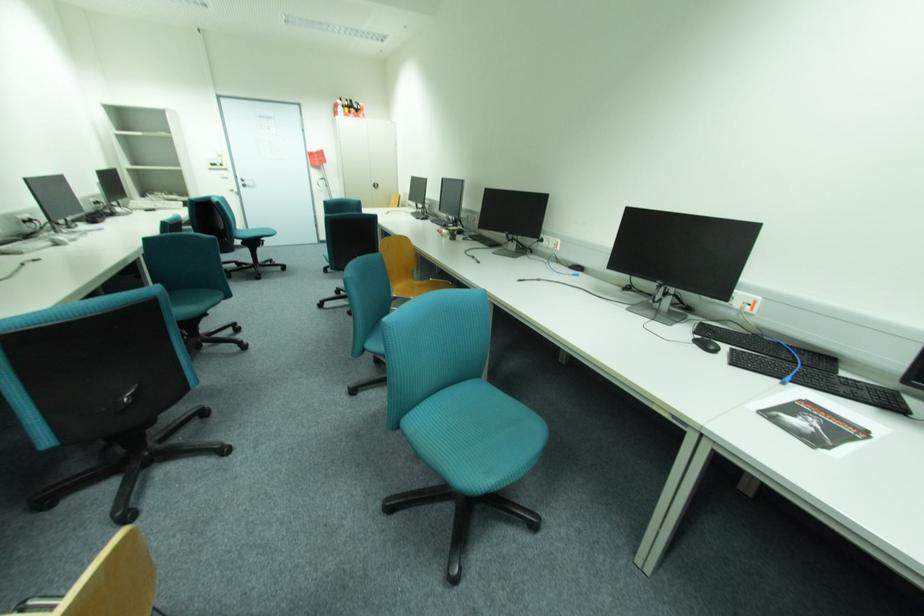
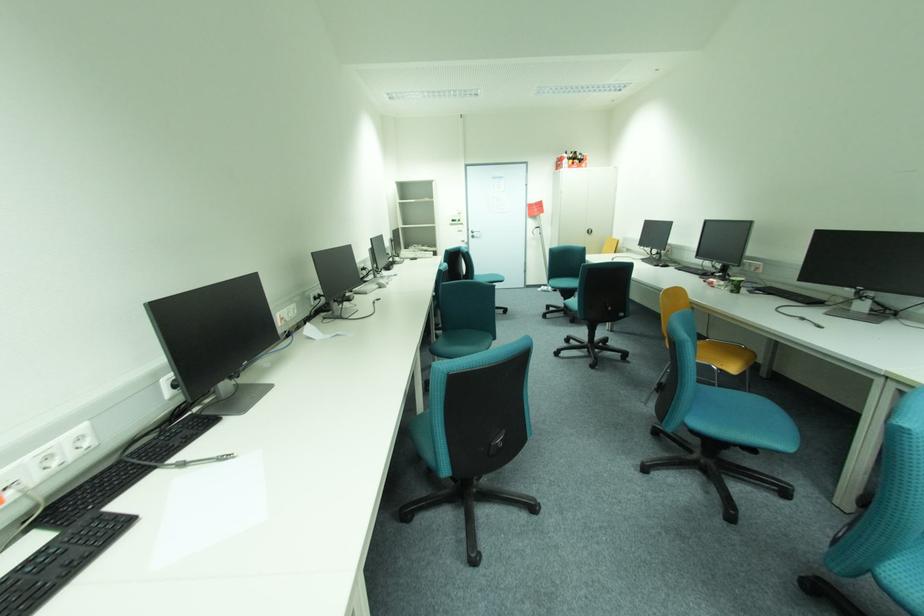
Question: I am providing you with two images of the same scene from different viewpoints. Please identify which objects are invisible in image2.

Choices:
 (A) green paper cup
 (B) teal chair sitting surface
 (C) yellow chair sitting surface
 (D) none of these

Answer: (D)